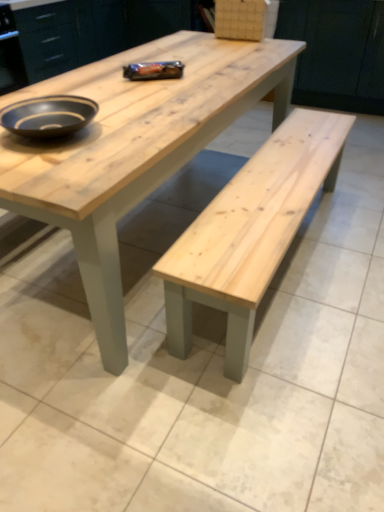
The width and height of the screenshot is (384, 512). In order to click on vacant location behind matte black bowl at upper left in this screenshot , I will do `click(105, 98)`.